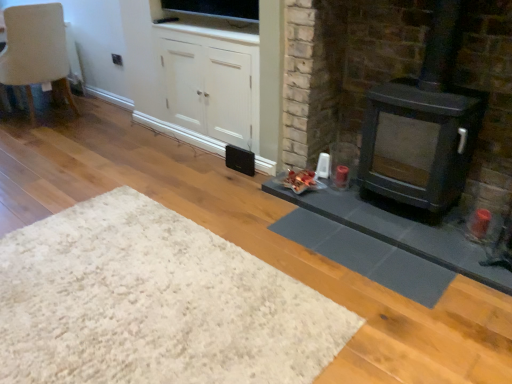
Question: Is the position of beige fabric chair at upper left less distant than that of white shaggy rug at lower left?

Choices:
 (A) yes
 (B) no

Answer: (B)

Question: Can we say beige fabric chair at upper left lies outside white shaggy rug at lower left?

Choices:
 (A) yes
 (B) no

Answer: (A)

Question: From a real-world perspective, is beige fabric chair at upper left below white shaggy rug at lower left?

Choices:
 (A) no
 (B) yes

Answer: (A)

Question: Is beige fabric chair at upper left wider than white shaggy rug at lower left?

Choices:
 (A) no
 (B) yes

Answer: (A)

Question: Can you confirm if beige fabric chair at upper left is thinner than white shaggy rug at lower left?

Choices:
 (A) yes
 (B) no

Answer: (A)

Question: From the image's perspective, is matte black stove at right above or below white matte cabinet at center?

Choices:
 (A) above
 (B) below

Answer: (B)

Question: From a real-world perspective, relative to white matte cabinet at center, is matte black stove at right vertically above or below?

Choices:
 (A) below
 (B) above

Answer: (B)

Question: Does point (500, 24) appear closer or farther from the camera than point (217, 137)?

Choices:
 (A) closer
 (B) farther

Answer: (A)

Question: Is matte black stove at right to the left or to the right of white matte cabinet at center in the image?

Choices:
 (A) left
 (B) right

Answer: (B)

Question: In terms of width, does matte black wood burning stove at right look wider or thinner when compared to white shaggy rug at lower left?

Choices:
 (A) wide
 (B) thin

Answer: (B)

Question: In terms of size, does matte black wood burning stove at right appear bigger or smaller than white shaggy rug at lower left?

Choices:
 (A) small
 (B) big

Answer: (B)

Question: Is matte black wood burning stove at right to the left or to the right of white shaggy rug at lower left in the image?

Choices:
 (A) left
 (B) right

Answer: (B)

Question: From a real-world perspective, is matte black wood burning stove at right positioned above or below white shaggy rug at lower left?

Choices:
 (A) below
 (B) above

Answer: (B)

Question: Relative to white shaggy rug at lower left, is white matte cabinet at center in front or behind?

Choices:
 (A) behind
 (B) front

Answer: (A)

Question: From the image's perspective, is white matte cabinet at center located above or below white shaggy rug at lower left?

Choices:
 (A) above
 (B) below

Answer: (A)